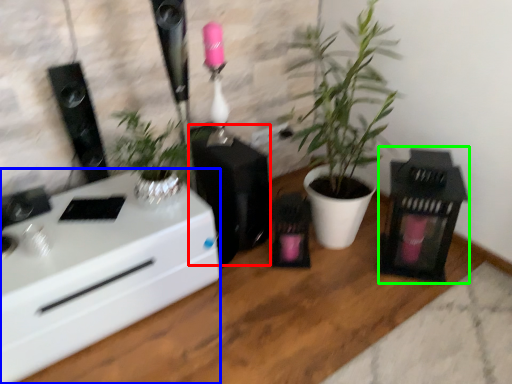
Question: Estimate the real-world distances between objects in this image. Which object is farther from appliance (highlighted by a red box), desk (highlighted by a blue box) or appliance (highlighted by a green box)?

Choices:
 (A) desk
 (B) appliance

Answer: (B)